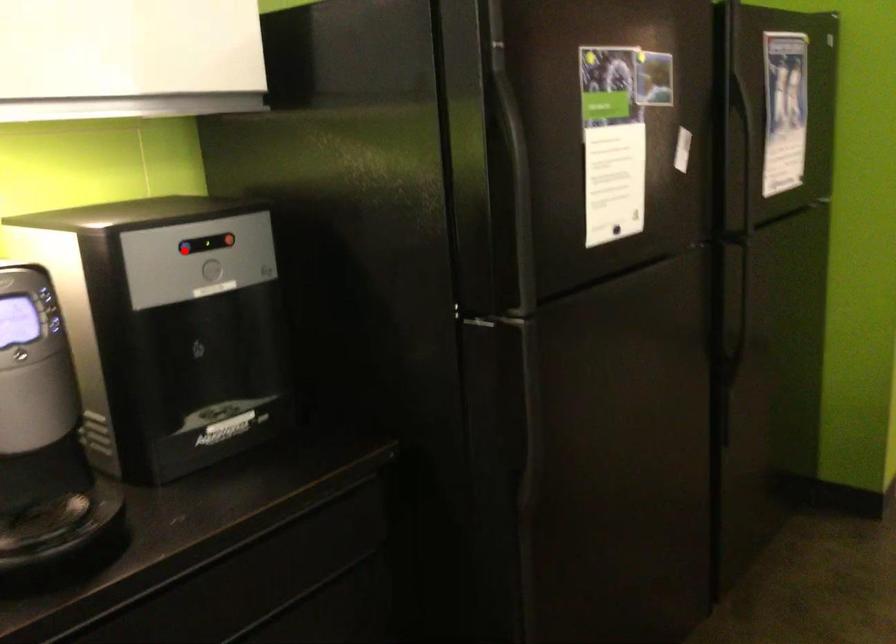
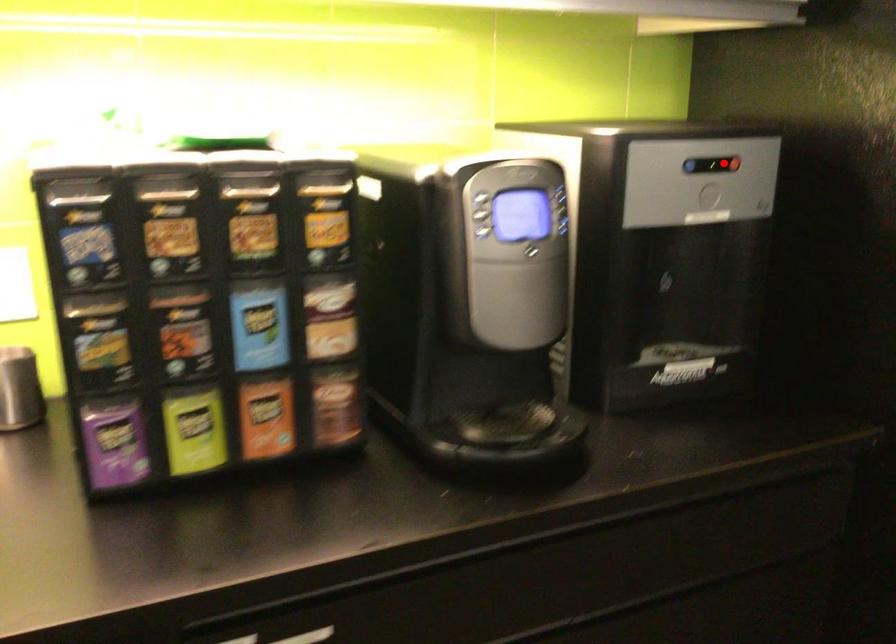
I am providing you with two images of the same scene from different viewpoints. A red point is marked on the first image and another point is marked on the second image. Do the highlighted points in image1 and image2 indicate the same real-world spot?

No